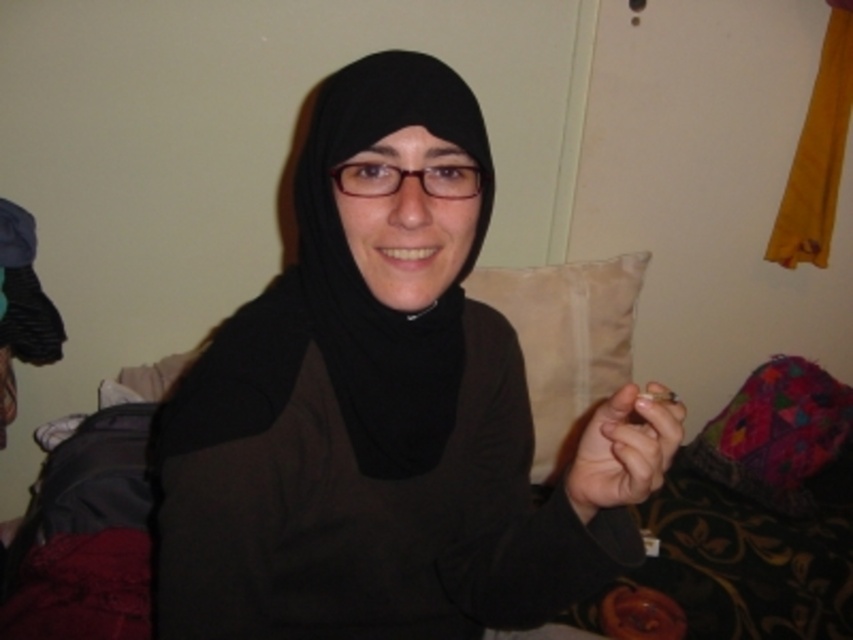
You are a fashion designer analyzing the image. You need to determine which item has a greater width between the black matte hijab at center and the black matte scarf at center. Which one is wider?

The black matte hijab at center is wider than the black matte scarf at center according to the description.

From the picture: You are a photographer trying to capture the subject wearing the black matte hijab at center. Since the hijab is covering part of their face, how does its size compare to the smooth skin at center to determine coverage?

The black matte hijab at center is larger in size than the smooth skin at center, so it covers more of the subject.

You are a photographer adjusting the lighting in the scene. You need to ensure that the black matte hijab at center and the smooth skin at center are both well lit. Since the hijab is above the skin, which object should you adjust the light to focus on first to ensure proper exposure for both?

The black matte hijab at center is located above smooth skin at center. To ensure proper exposure for both, you should first focus the light on the smooth skin at center because it is below the hijab and might be in shadow, then adjust the light to also illuminate the hijab properly.